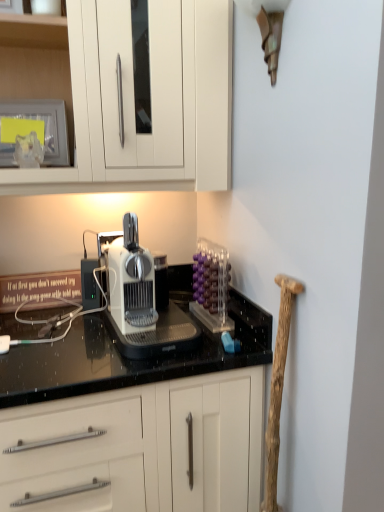
Question: Considering the positions of transparent acrylic container at upper right and black granite countertop at center in the image, is transparent acrylic container at upper right taller or shorter than black granite countertop at center?

Choices:
 (A) short
 (B) tall

Answer: (A)

Question: In terms of width, does transparent acrylic container at upper right look wider or thinner when compared to black granite countertop at center?

Choices:
 (A) thin
 (B) wide

Answer: (A)

Question: Estimate the real-world distances between objects in this image. Which object is closer to the white plastic coffee machine at center?

Choices:
 (A) transparent acrylic container at upper right
 (B) wooden at right
 (C) black granite countertop at center
 (D) matte glass frame at upper left

Answer: (C)

Question: Which object is positioned closest to the transparent acrylic container at upper right?

Choices:
 (A) white plastic coffee machine at center
 (B) wooden at right
 (C) matte glass frame at upper left
 (D) black granite countertop at center

Answer: (D)